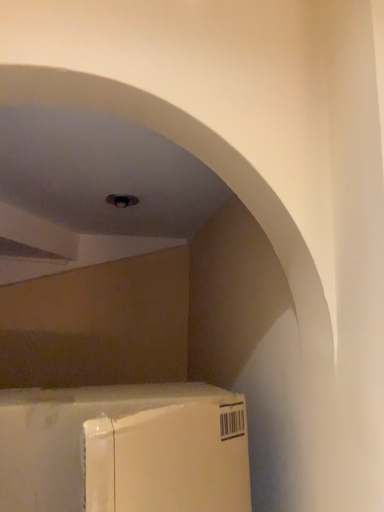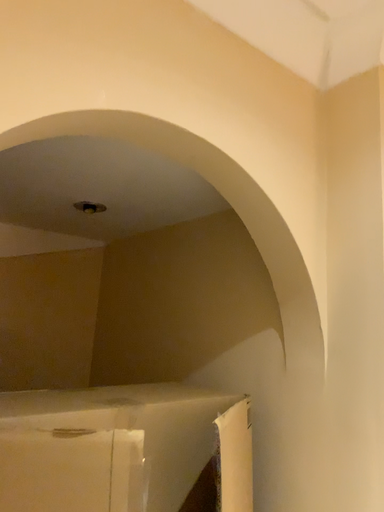
Question: Which way did the camera rotate in the video?

Choices:
 (A) rotated right
 (B) rotated left

Answer: (A)